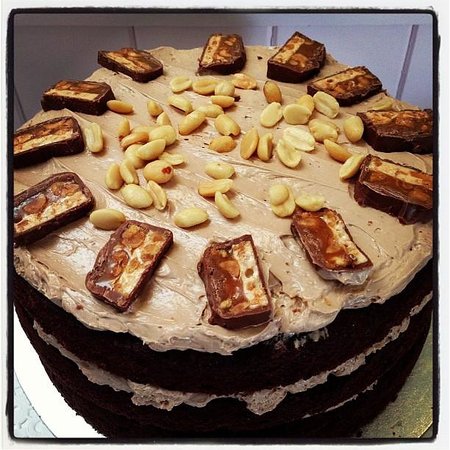
At what (x,y) coordinates should I click in order to perform the action: click on silver cake plate in lower right corner. Please return your answer as a coordinate pair (x, y). Looking at the image, I should click on (411, 414).